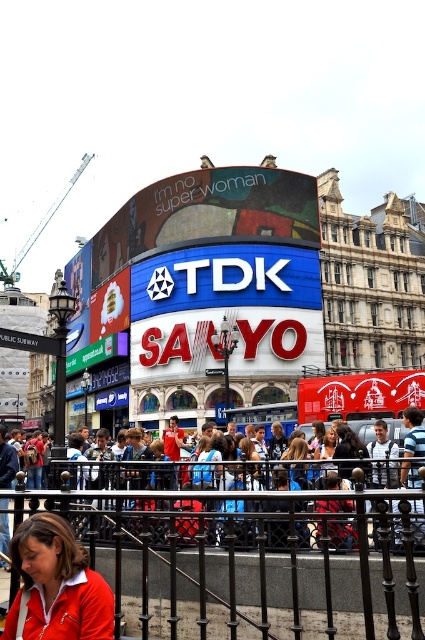
Question: Does blue denim jeans at lower center lie behind matte blue shirt at center?

Choices:
 (A) yes
 (B) no

Answer: (B)

Question: Which object is positioned closest to the matte red jacket at lower left?

Choices:
 (A) blue denim jeans at lower center
 (B) matte black hair at center

Answer: (A)

Question: Which object is positioned farthest from the matte blue shirt at center?

Choices:
 (A) blue denim jeans at lower center
 (B) matte red jacket at lower left
 (C) matte black hair at center
 (D) black wrought iron fence at lower center

Answer: (B)

Question: Is blue denim jeans at lower center below matte black hair at center?

Choices:
 (A) no
 (B) yes

Answer: (B)

Question: Which object is farther from the camera taking this photo?

Choices:
 (A) black wrought iron fence at lower center
 (B) matte blue shirt at center
 (C) blue denim jeans at lower center
 (D) matte red jacket at lower left

Answer: (B)

Question: Is black wrought iron fence at lower center in front of blue denim jeans at lower center?

Choices:
 (A) yes
 (B) no

Answer: (A)